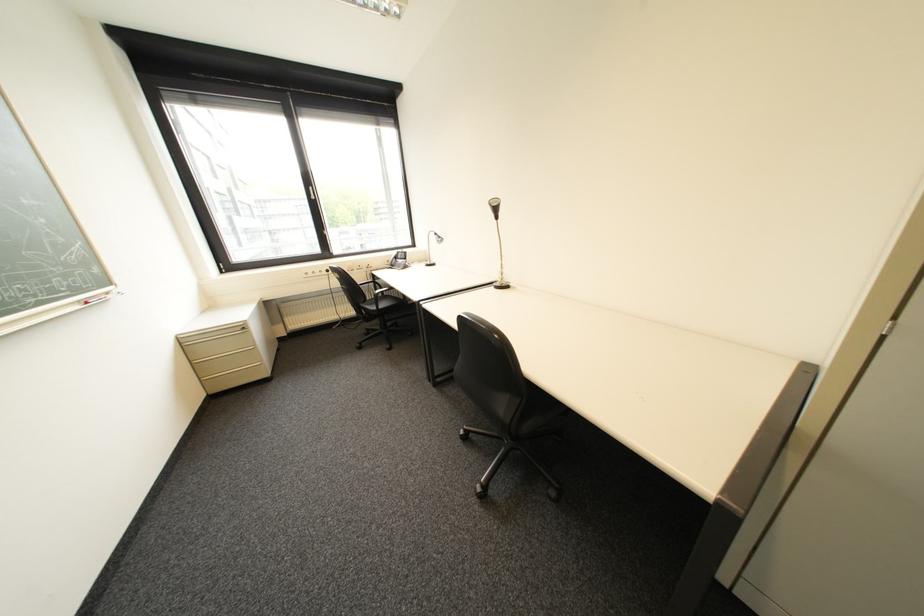
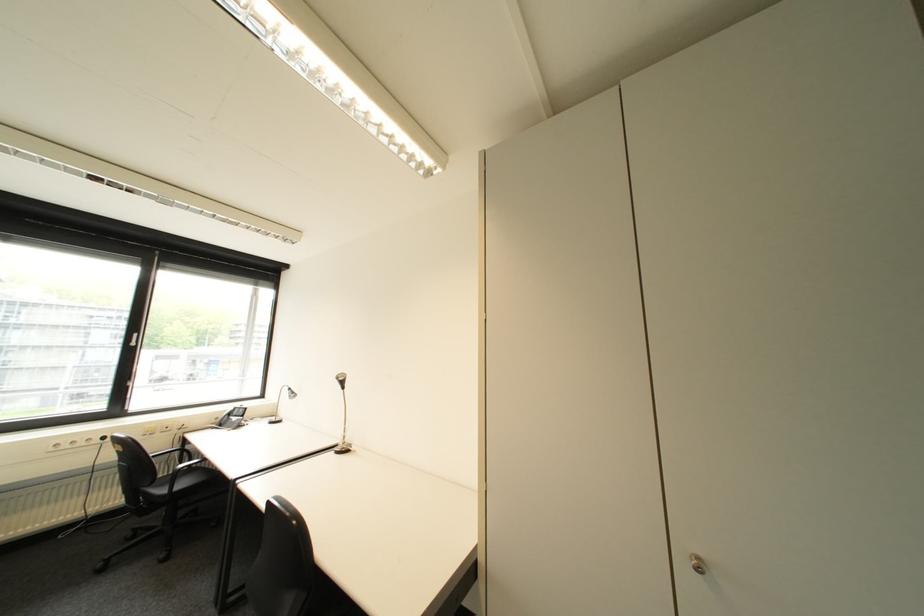
Find the pixel in the second image that matches (407,253) in the first image.

(246, 408)